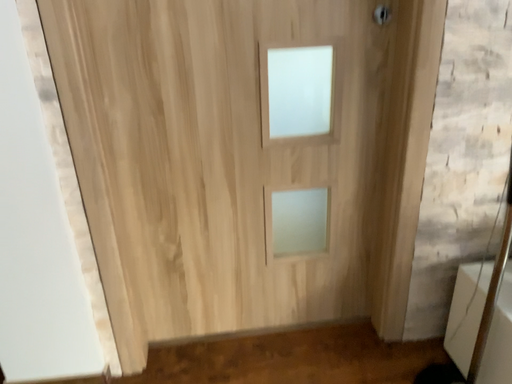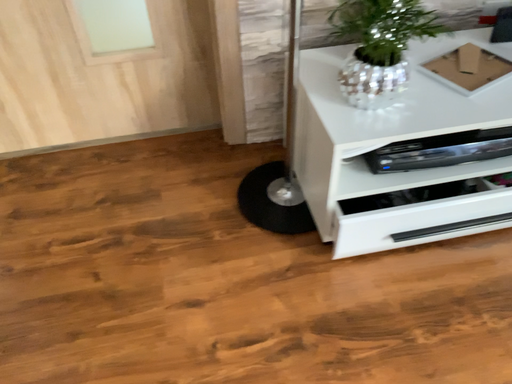
Question: How did the camera likely rotate when shooting the video?

Choices:
 (A) rotated upward
 (B) rotated downward

Answer: (B)